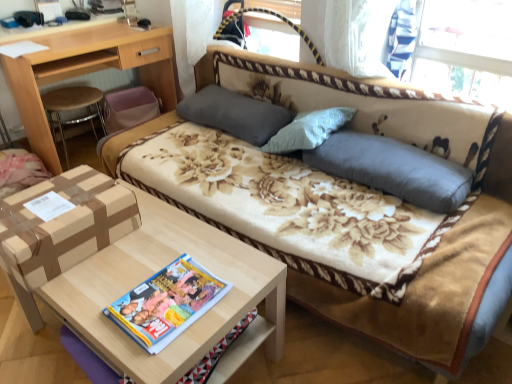
Identify the location of vacant space that is in between multicolored glossy magazine at center and brown cardboard box at lower left. [x=118, y=276].